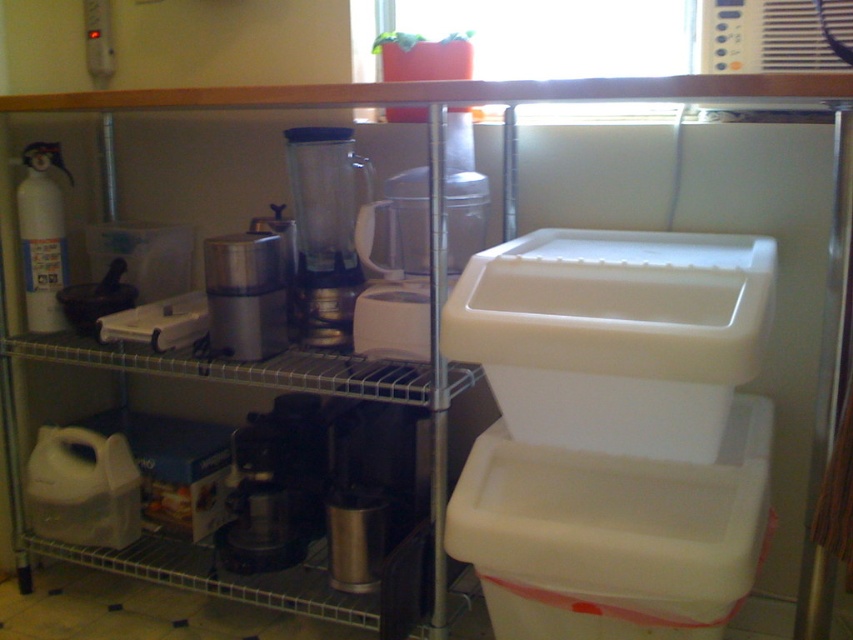
Question: Is white plastic container at center right to the left of clear plastic blender at center from the viewer's perspective?

Choices:
 (A) no
 (B) yes

Answer: (A)

Question: Is white plastic container at center right bigger than clear plastic blender at center?

Choices:
 (A) no
 (B) yes

Answer: (B)

Question: Does white plastic container at center right appear on the left side of satin silver appliance at center?

Choices:
 (A) no
 (B) yes

Answer: (A)

Question: Which of the following is the closest to the observer?

Choices:
 (A) satin silver appliance at center
 (B) clear plastic blender at center

Answer: (A)

Question: Among these objects, which one is farthest from the camera?

Choices:
 (A) clear plastic blender at center
 (B) white plastic container at center right

Answer: (A)

Question: Which of the following is the closest to the observer?

Choices:
 (A) (305, 333)
 (B) (549, 605)

Answer: (B)